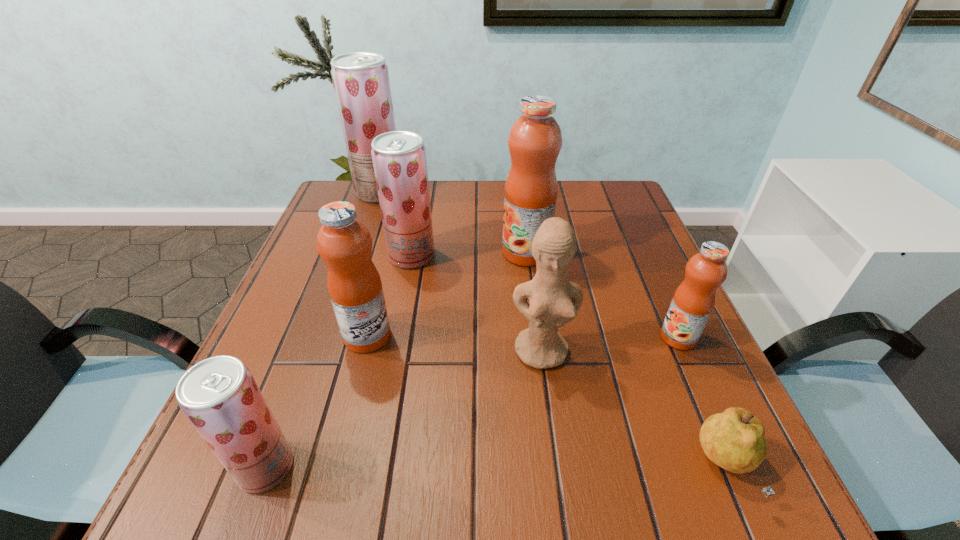
The height and width of the screenshot is (540, 960). In order to click on the rightmost orange fruit juice in this screenshot , I will do `click(693, 302)`.

Where is `the rightmost fruit juice`? The height and width of the screenshot is (540, 960). the rightmost fruit juice is located at coordinates (693, 302).

In order to click on pear in this screenshot , I will do `click(734, 440)`.

This screenshot has height=540, width=960. I want to click on free space located on the front of the farthest strawberry fruit juice, so click(365, 238).

Where is `free space located 0.160m on the front label of the biggest orange fruit juice`? The width and height of the screenshot is (960, 540). free space located 0.160m on the front label of the biggest orange fruit juice is located at coordinates (438, 253).

Identify the location of vacant position located on the front label of the biggest orange fruit juice. The width and height of the screenshot is (960, 540). (426, 253).

Image resolution: width=960 pixels, height=540 pixels. Find the location of `vacant space located 0.150m on the front label of the biggest orange fruit juice`. vacant space located 0.150m on the front label of the biggest orange fruit juice is located at coordinates (442, 253).

I want to click on vacant space located 0.290m on the right of the second smallest strawberry fruit juice, so click(552, 256).

Where is `free location located 0.330m on the front label of the leftmost orange fruit juice`? free location located 0.330m on the front label of the leftmost orange fruit juice is located at coordinates (554, 336).

The image size is (960, 540). I want to click on free space located on the front-facing side of the figurine, so click(x=551, y=420).